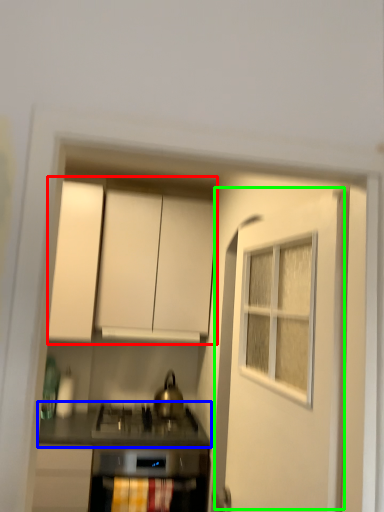
Question: Which is farther away from cabinetry (highlighted by a red box)? countertop (highlighted by a blue box) or door (highlighted by a green box)?

Choices:
 (A) countertop
 (B) door

Answer: (B)